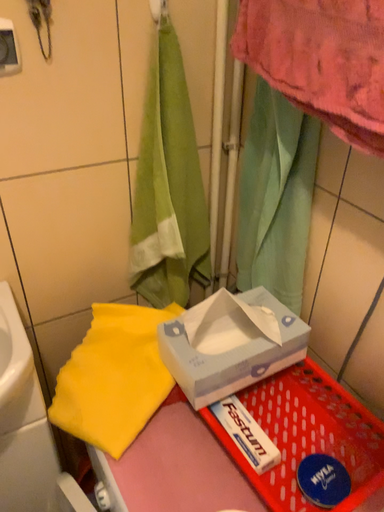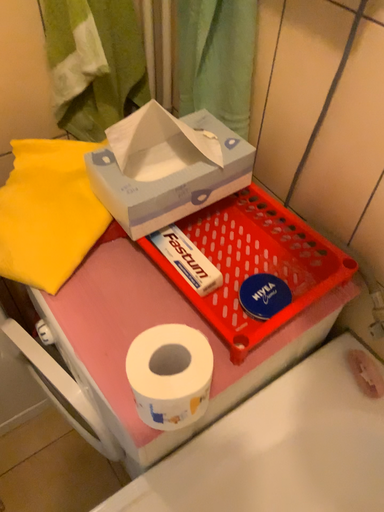
Question: Which way did the camera rotate in the video?

Choices:
 (A) rotated downward
 (B) rotated upward

Answer: (A)